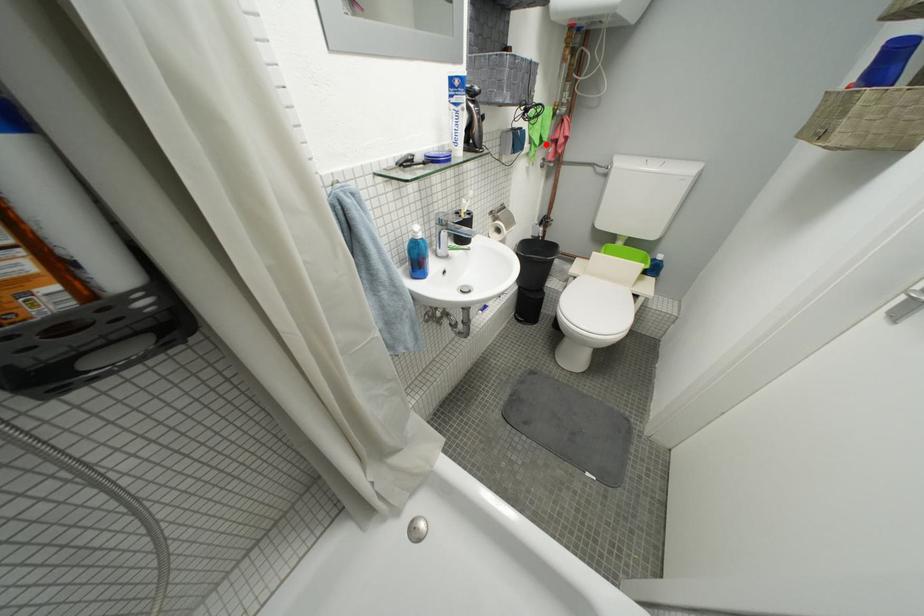
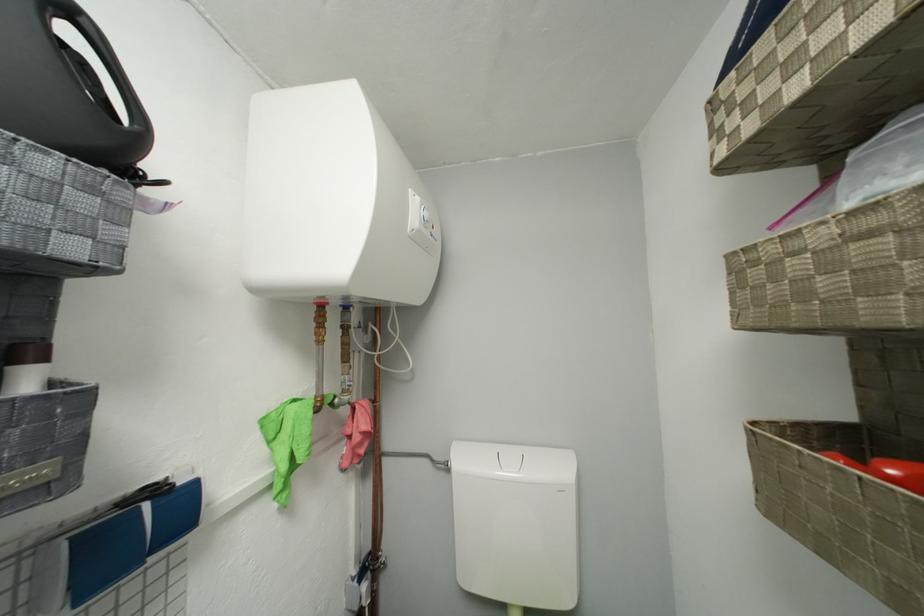
The point at the highlighted location is marked in the first image. Where is the corresponding point in the second image?

(293, 469)